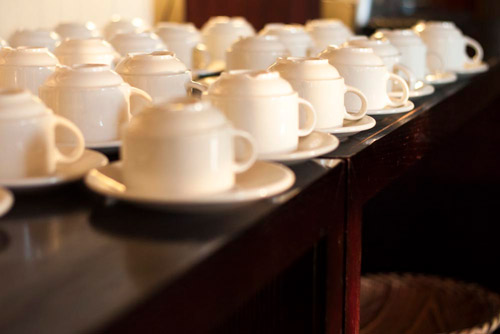
Find the location of `dish`. dish is located at coordinates (66, 185), (114, 144), (138, 178), (311, 147), (352, 128), (391, 110), (419, 95), (444, 79), (470, 67).